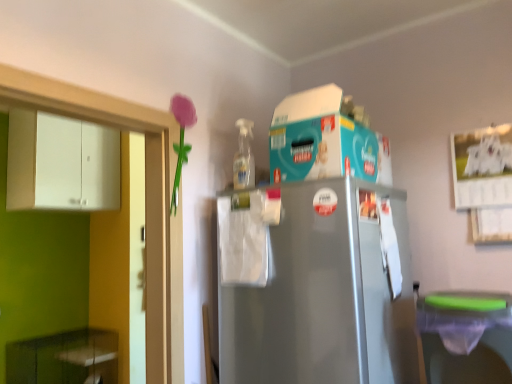
Measure the distance between point (325, 112) and camera.

The distance of point (325, 112) from camera is 4.62 feet.

Where is `white matte cabinet at left, which is the 2th cabinetry from bottom to top`? white matte cabinet at left, which is the 2th cabinetry from bottom to top is located at coordinates (61, 163).

The image size is (512, 384). Describe the element at coordinates (466, 336) in the screenshot. I see `green plastic dish washer at lower right` at that location.

The image size is (512, 384). Describe the element at coordinates (181, 140) in the screenshot. I see `matte plastic flower at upper left` at that location.

The width and height of the screenshot is (512, 384). Describe the element at coordinates (64, 358) in the screenshot. I see `green glossy cabinet at lower left, marked as the first cabinetry in a bottom-to-top arrangement` at that location.

Image resolution: width=512 pixels, height=384 pixels. Identify the location of teal cardboard box at upper center. (326, 139).

In the image, is matte plastic flower at upper left positioned in front of or behind teal cardboard box at upper center?

Visually, matte plastic flower at upper left is located behind teal cardboard box at upper center.

Is matte plastic flower at upper left positioned beyond the bounds of teal cardboard box at upper center?

Yes.

Looking at their sizes, would you say matte plastic flower at upper left is wider or thinner than teal cardboard box at upper center?

In the image, matte plastic flower at upper left appears to be more narrow than teal cardboard box at upper center.

Between point (181, 147) and point (308, 177), which one is positioned behind?

Positioned behind is point (181, 147).

Looking at this image, is matte plastic flower at upper left in front of or behind green plastic dish washer at lower right in the image?

Clearly, matte plastic flower at upper left is behind green plastic dish washer at lower right.

Is point (174, 181) positioned before point (435, 374)?

No, (174, 181) is behind (435, 374).

From the image's perspective, is matte plastic flower at upper left on green plastic dish washer at lower right?

Yes, from the image's perspective, matte plastic flower at upper left is over green plastic dish washer at lower right.

Who is bigger, matte plastic flower at upper left or green plastic dish washer at lower right?

With larger size is green plastic dish washer at lower right.

From a real-world perspective, which object rests below the other?

In real-world perspective, green glossy cabinet at lower left, placed as the 2th cabinetry when sorted from top to bottom, is lower.

Could you tell me if green glossy cabinet at lower left, marked as the first cabinetry in a bottom-to-top arrangement, is turned towards teal cardboard box at upper center?

No, green glossy cabinet at lower left, marked as the first cabinetry in a bottom-to-top arrangement, is not turned towards teal cardboard box at upper center.

In terms of size, does green glossy cabinet at lower left, marked as the first cabinetry in a bottom-to-top arrangement, appear bigger or smaller than teal cardboard box at upper center?

Considering their sizes, green glossy cabinet at lower left, marked as the first cabinetry in a bottom-to-top arrangement, takes up more space than teal cardboard box at upper center.

From the picture: Could you measure the distance between green glossy cabinet at lower left, placed as the 2th cabinetry when sorted from top to bottom, and teal cardboard box at upper center?

7.65 feet.

Is white matte cabinet at left, which is the 2th cabinetry from bottom to top, positioned with its back to teal cardboard box at upper center?

That's not correct — white matte cabinet at left, which is the 2th cabinetry from bottom to top, is not looking away from teal cardboard box at upper center.

Which of these two, white matte cabinet at left, which is the 2th cabinetry from bottom to top, or teal cardboard box at upper center, is wider?

teal cardboard box at upper center is wider.

How different are the orientations of white matte cabinet at left, the first cabinetry in the top-to-bottom sequence, and teal cardboard box at upper center in degrees?

90.6 degrees separate the facing orientations of white matte cabinet at left, the first cabinetry in the top-to-bottom sequence, and teal cardboard box at upper center.

Which object is positioned more to the right, white matte cabinet at left, which is the 2th cabinetry from bottom to top, or teal cardboard box at upper center?

teal cardboard box at upper center is more to the right.

Based on the photo, considering the sizes of objects green plastic dish washer at lower right and matte plastic flower at upper left in the image provided, who is bigger, green plastic dish washer at lower right or matte plastic flower at upper left?

green plastic dish washer at lower right.

Image resolution: width=512 pixels, height=384 pixels. Find the location of `flower located behind the green plastic dish washer at lower right`. flower located behind the green plastic dish washer at lower right is located at coordinates (181, 140).

Are green plastic dish washer at lower right and matte plastic flower at upper left beside each other?

green plastic dish washer at lower right is not next to matte plastic flower at upper left, and they're not touching.

Is green plastic dish washer at lower right taller than matte plastic flower at upper left?

No, green plastic dish washer at lower right is not taller than matte plastic flower at upper left.

Would you say matte plastic flower at upper left is inside or outside white matte cabinet at left, which is the 2th cabinetry from bottom to top?

matte plastic flower at upper left is spatially situated outside white matte cabinet at left, which is the 2th cabinetry from bottom to top.

From a real-world perspective, between matte plastic flower at upper left and white matte cabinet at left, the first cabinetry in the top-to-bottom sequence, who is vertically lower?

matte plastic flower at upper left, from a real-world perspective.

Is matte plastic flower at upper left far from white matte cabinet at left, the first cabinetry in the top-to-bottom sequence?

Yes.

At what (x,y) coordinates should I click in order to perform the action: click on flower located below the white matte cabinet at left, which is the 2th cabinetry from bottom to top (from the image's perspective). Please return your answer as a coordinate pair (x, y). The image size is (512, 384). Looking at the image, I should click on (181, 140).

Does white matte cabinet at left, the first cabinetry in the top-to-bottom sequence, touch matte plastic flower at upper left?

No, white matte cabinet at left, the first cabinetry in the top-to-bottom sequence, is not making contact with matte plastic flower at upper left.

In terms of width, does white matte cabinet at left, the first cabinetry in the top-to-bottom sequence, look wider or thinner when compared to matte plastic flower at upper left?

white matte cabinet at left, the first cabinetry in the top-to-bottom sequence, is wider than matte plastic flower at upper left.

From a real-world perspective, is white matte cabinet at left, which is the 2th cabinetry from bottom to top, positioned above or below matte plastic flower at upper left?

white matte cabinet at left, which is the 2th cabinetry from bottom to top, is situated higher than matte plastic flower at upper left in the real world.

The height and width of the screenshot is (384, 512). What are the coordinates of `flower that is behind the teal cardboard box at upper center` in the screenshot? It's located at (181, 140).

You are a GUI agent. You are given a task and a screenshot of the screen. Output one action in this format:
    pyautogui.click(x=<x>, y=<y>)
    Task: Click on the flower positioned vertically above the green plastic dish washer at lower right (from a real-world perspective)
    Image resolution: width=512 pixels, height=384 pixels.
    Given the screenshot: What is the action you would take?
    pyautogui.click(x=181, y=140)

From the image, which object appears to be farther from white matte cabinet at left, the first cabinetry in the top-to-bottom sequence, matte plastic flower at upper left or teal cardboard box at upper center?

teal cardboard box at upper center lies further to white matte cabinet at left, the first cabinetry in the top-to-bottom sequence, than the other object.

Considering their positions, is white matte cabinet at left, which is the 2th cabinetry from bottom to top, positioned closer to matte plastic flower at upper left than green plastic dish washer at lower right?

green plastic dish washer at lower right.

Looking at this image, when comparing their distances from white matte cabinet at left, which is the 2th cabinetry from bottom to top, does green glossy cabinet at lower left, placed as the 2th cabinetry when sorted from top to bottom, or teal cardboard box at upper center seem further?

teal cardboard box at upper center.

From the image, which object appears to be farther from green plastic dish washer at lower right, teal cardboard box at upper center or green glossy cabinet at lower left, marked as the first cabinetry in a bottom-to-top arrangement?

The object further to green plastic dish washer at lower right is green glossy cabinet at lower left, marked as the first cabinetry in a bottom-to-top arrangement.

Based on their spatial positions, is green plastic dish washer at lower right or white matte cabinet at left, the first cabinetry in the top-to-bottom sequence, closer to matte plastic flower at upper left?

green plastic dish washer at lower right.

When comparing their distances from green plastic dish washer at lower right, does white matte cabinet at left, the first cabinetry in the top-to-bottom sequence, or green glossy cabinet at lower left, placed as the 2th cabinetry when sorted from top to bottom, seem further?

green glossy cabinet at lower left, placed as the 2th cabinetry when sorted from top to bottom, is further to green plastic dish washer at lower right.

Looking at the image, which one is located further to green glossy cabinet at lower left, marked as the first cabinetry in a bottom-to-top arrangement, matte plastic flower at upper left or green plastic dish washer at lower right?

The object further to green glossy cabinet at lower left, marked as the first cabinetry in a bottom-to-top arrangement, is green plastic dish washer at lower right.

When comparing their distances from matte plastic flower at upper left, does green glossy cabinet at lower left, placed as the 2th cabinetry when sorted from top to bottom, or green plastic dish washer at lower right seem closer?

The object closer to matte plastic flower at upper left is green plastic dish washer at lower right.

At what (x,y) coordinates should I click in order to perform the action: click on appliance between white matte cabinet at left, the first cabinetry in the top-to-bottom sequence, and green plastic dish washer at lower right. Please return your answer as a coordinate pair (x, y). Looking at the image, I should click on (326, 139).

The image size is (512, 384). What are the coordinates of `flower between green glossy cabinet at lower left, marked as the first cabinetry in a bottom-to-top arrangement, and teal cardboard box at upper center from left to right` in the screenshot? It's located at (181, 140).

Identify the location of appliance between green glossy cabinet at lower left, placed as the 2th cabinetry when sorted from top to bottom, and green plastic dish washer at lower right, in the horizontal direction. (326, 139).

You are a GUI agent. You are given a task and a screenshot of the screen. Output one action in this format:
    pyautogui.click(x=<x>, y=<y>)
    Task: Click on the flower between green glossy cabinet at lower left, placed as the 2th cabinetry when sorted from top to bottom, and green plastic dish washer at lower right from left to right
    
    Given the screenshot: What is the action you would take?
    pyautogui.click(x=181, y=140)